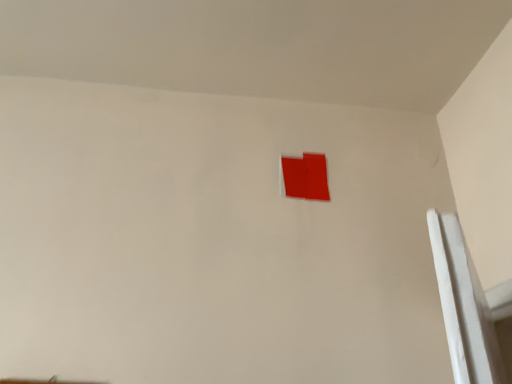
I want to click on matte red rectangle at center, so click(305, 177).

What do you see at coordinates (305, 177) in the screenshot? The height and width of the screenshot is (384, 512). I see `matte red rectangle at center` at bounding box center [305, 177].

The width and height of the screenshot is (512, 384). I want to click on matte red rectangle at center, so click(x=305, y=177).